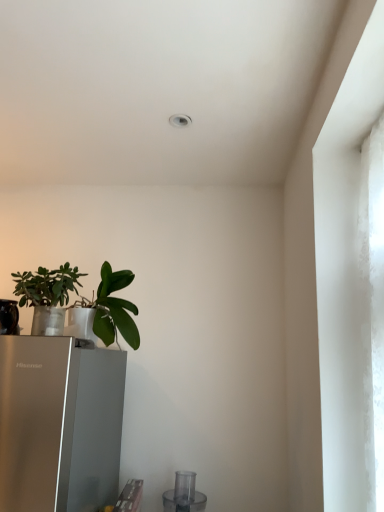
Question: Considering the positions of point (165, 503) and point (130, 337), is point (165, 503) closer or farther from the camera than point (130, 337)?

Choices:
 (A) farther
 (B) closer

Answer: (A)

Question: Is transparent plastic blender at lower center wider or thinner than green matte leafy plant at lower left, which is counted as the 1th houseplant, starting from the right?

Choices:
 (A) wide
 (B) thin

Answer: (A)

Question: Which object is positioned farthest from the transparent plastic blender at lower center?

Choices:
 (A) green matte plant at left, acting as the 2th houseplant starting from the right
 (B) green matte leafy plant at lower left, which is the 2th houseplant in left-to-right order

Answer: (A)

Question: Which of these objects is positioned closest to the transparent plastic blender at lower center?

Choices:
 (A) green matte plant at left, acting as the 2th houseplant starting from the right
 (B) green matte leafy plant at lower left, which is the 2th houseplant in left-to-right order

Answer: (B)